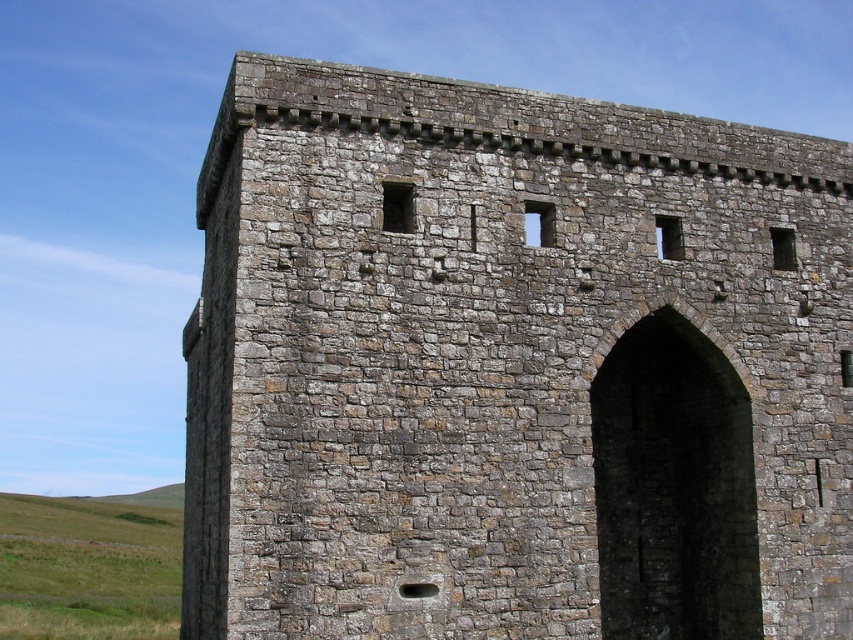
Is point (682, 176) positioned behind point (61, 627)?

No, it is in front of (61, 627).

Is point (502, 380) in front of point (120, 509)?

Yes.

Is point (447, 250) farther from viewer compared to point (77, 625)?

No, (447, 250) is in front of (77, 625).

The width and height of the screenshot is (853, 640). Find the location of `brown stone wall at center`. brown stone wall at center is located at coordinates (514, 368).